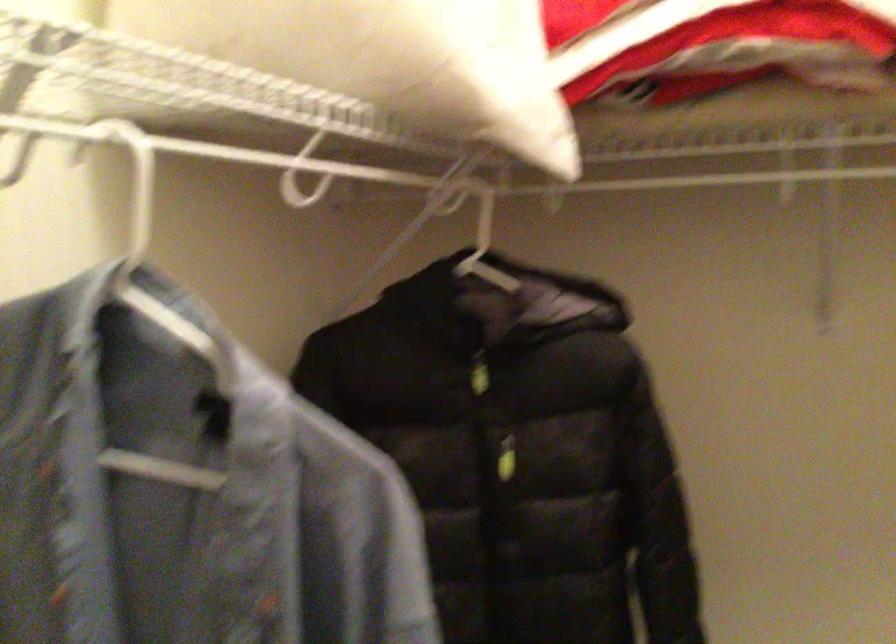
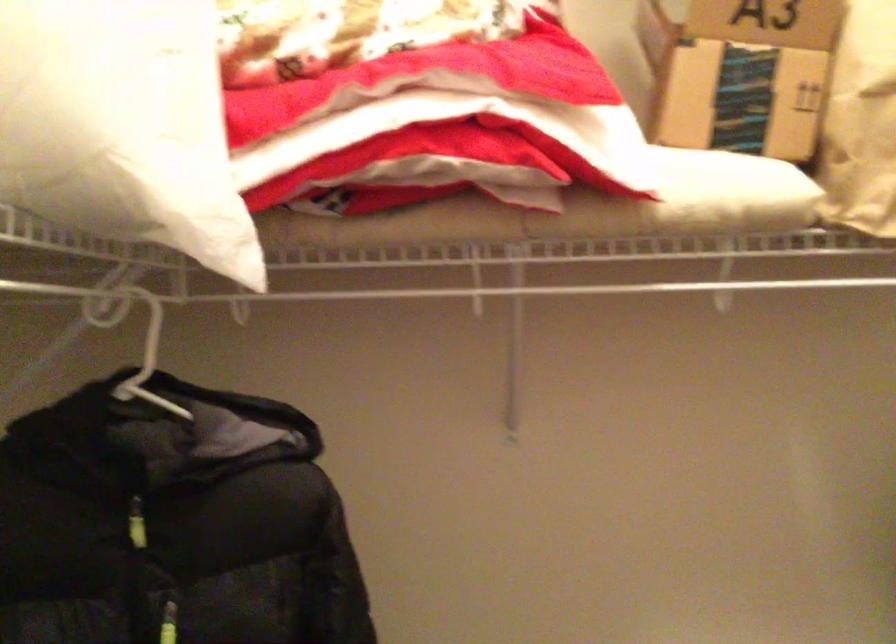
Find the pixel in the second image that matches point (467, 236) in the first image.

(138, 344)